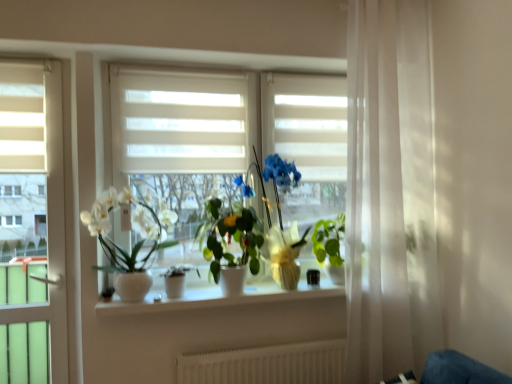
Question: Does point (181, 274) appear closer or farther from the camera than point (11, 127)?

Choices:
 (A) closer
 (B) farther

Answer: (B)

Question: From the image's perspective, relative to white matte blind at upper left, placed as the second blind when sorted from back to front, is matte white pot at center, which is the 2th houseplant from left to right, above or below?

Choices:
 (A) below
 (B) above

Answer: (A)

Question: Which is nearer to the green glossy plant at center, the 1th houseplant viewed from the right?

Choices:
 (A) white textured radiator at lower center
 (B) white ceramic vase at center
 (C) white glossy pot at left, positioned as the 1th houseplant in left-to-right order
 (D) white matte blind at upper left, acting as the second blind starting from the right
 (E) white matte blind at center, which is the second blind in front-to-back order

Answer: (B)

Question: Estimate the real-world distances between objects in this image. Which object is closer to the white ceramic vase at center?

Choices:
 (A) white matte blind at upper left, the first blind positioned from the left
 (B) white matte blind at center, which is the second blind in front-to-back order
 (C) white sheer curtain at right
 (D) green glossy plant at center, which appears as the fourth houseplant when viewed from the left
 (E) green glossy plant at center, which is the third houseplant in left-to-right order

Answer: (E)